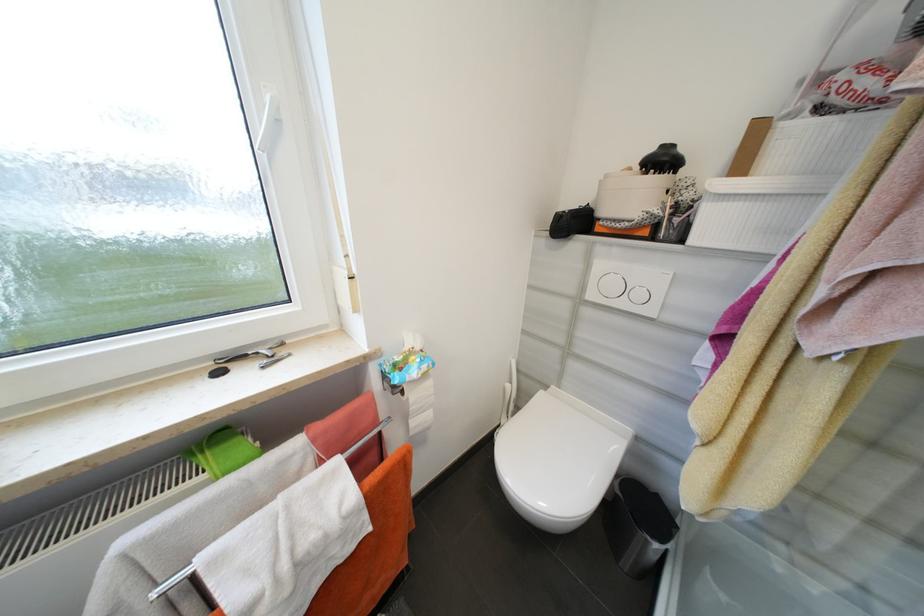
Image resolution: width=924 pixels, height=616 pixels. What do you see at coordinates (557, 459) in the screenshot? I see `the white toilet lid` at bounding box center [557, 459].